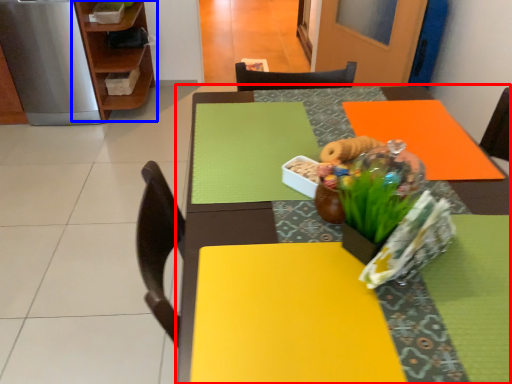
Question: Which object appears farthest to the camera in this image, table (highlighted by a red box) or shelf (highlighted by a blue box)?

Choices:
 (A) table
 (B) shelf

Answer: (B)